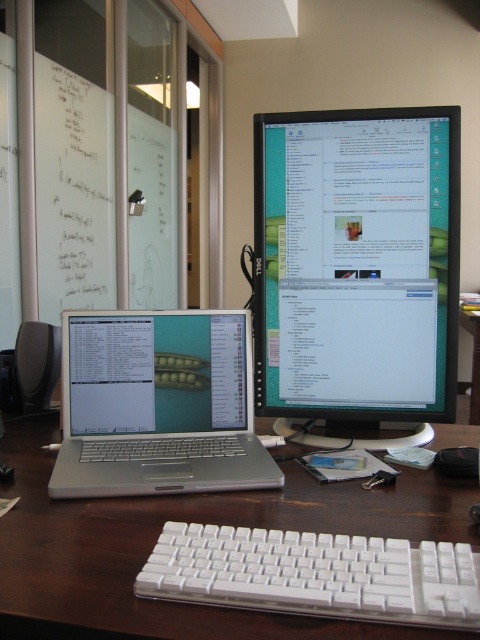
Looking at this image, which of these two, white plastic keyboard at lower center or brown wooden table at center, stands shorter?

With less height is white plastic keyboard at lower center.

Which is behind, point (383, 634) or point (469, 403)?

Point (469, 403)

Describe the element at coordinates (188, 522) in the screenshot. I see `white plastic keyboard at lower center` at that location.

At what (x,y) coordinates should I click in order to perform the action: click on white plastic keyboard at lower center. Please return your answer as a coordinate pair (x, y). The image size is (480, 640). Looking at the image, I should click on click(188, 522).

Is silver metallic laptop at left taller than white plastic keyboard at center?

Yes, silver metallic laptop at left is taller than white plastic keyboard at center.

Does point (244, 333) lie behind point (411, 577)?

Yes.

Based on the photo, who is more forward, (222, 352) or (175, 588)?

Positioned in front is point (175, 588).

Find the location of a particular element. The width and height of the screenshot is (480, 640). silver metallic laptop at left is located at coordinates (157, 404).

Can you confirm if matte black monitor at upper right is shorter than white plastic keyboard at lower center?

No, matte black monitor at upper right is not shorter than white plastic keyboard at lower center.

Can you confirm if matte black monitor at upper right is smaller than white plastic keyboard at lower center?

Yes, matte black monitor at upper right is smaller than white plastic keyboard at lower center.

The image size is (480, 640). I want to click on matte black monitor at upper right, so click(357, 266).